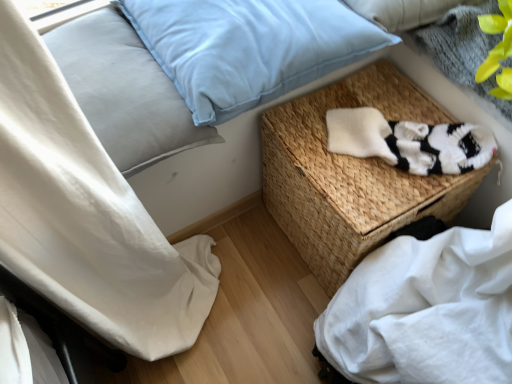
The image size is (512, 384). Describe the element at coordinates (351, 174) in the screenshot. I see `woven wicker basket at center` at that location.

What is the approximate width of white knitted socks at center-right?

It is 19.23 centimeters.

At what (x,y) coordinates should I click in order to perform the action: click on white knitted socks at center-right. Please return your answer as a coordinate pair (x, y). The image size is (512, 384). Looking at the image, I should click on (409, 142).

Describe the element at coordinates (124, 91) in the screenshot. I see `light blue fabric pillow at upper left, which is the 2th pillow from right to left` at that location.

Where is `woven wicker basket at center`? The width and height of the screenshot is (512, 384). woven wicker basket at center is located at coordinates (351, 174).

From the image's perspective, between white cotton sheet at lower right and white knitted socks at center-right, who is located below?

white cotton sheet at lower right is shown below in the image.

Is white cotton sheet at lower right oriented towards white knitted socks at center-right?

No, white cotton sheet at lower right is not oriented towards white knitted socks at center-right.

Looking at this image, from a real-world perspective, is white cotton sheet at lower right beneath white knitted socks at center-right?

Correct, in the physical world, white cotton sheet at lower right is lower than white knitted socks at center-right.

Would you say white knitted socks at center-right is to the left or to the right of light blue fabric pillow at upper left, which is the 2th pillow from right to left, in the picture?

Clearly, white knitted socks at center-right is on the right of light blue fabric pillow at upper left, which is the 2th pillow from right to left, in the image.

Is white knitted socks at center-right positioned with its back to light blue fabric pillow at upper left, which is the 2th pillow from right to left?

That's not correct — white knitted socks at center-right is not looking away from light blue fabric pillow at upper left, which is the 2th pillow from right to left.

Is the position of white knitted socks at center-right less distant than that of light blue fabric pillow at upper left, which is the first pillow in left-to-right order?

No, white knitted socks at center-right is further to the viewer.

Looking at their sizes, would you say white knitted socks at center-right is wider or thinner than light blue fabric pillow at upper left, which is the 2th pillow from right to left?

Considering their sizes, white knitted socks at center-right looks slimmer than light blue fabric pillow at upper left, which is the 2th pillow from right to left.

Is white knitted socks at center-right facing towards light blue velvety pillow at upper center, the second pillow from the left?

No, white knitted socks at center-right is not oriented towards light blue velvety pillow at upper center, the second pillow from the left.

In the scene shown: From a real-world perspective, is white knitted socks at center-right positioned over light blue velvety pillow at upper center, the second pillow from the left, based on gravity?

No, from a real-world perspective, white knitted socks at center-right is not above light blue velvety pillow at upper center, the second pillow from the left.

Between point (410, 131) and point (266, 80), which one is positioned behind?

The point (410, 131) is farther from the camera.

Is white knitted socks at center-right taller than light blue velvety pillow at upper center, the first pillow in the right-to-left sequence?

No, white knitted socks at center-right is not taller than light blue velvety pillow at upper center, the first pillow in the right-to-left sequence.

Considering the relative positions of white cotton sheet at lower right and light blue velvety pillow at upper center, the second pillow from the left, in the image provided, is white cotton sheet at lower right to the left or to the right of light blue velvety pillow at upper center, the second pillow from the left,?

white cotton sheet at lower right is to the right of light blue velvety pillow at upper center, the second pillow from the left.

Between white cotton sheet at lower right and light blue velvety pillow at upper center, the second pillow from the left, which one has less height?

Standing shorter between the two is light blue velvety pillow at upper center, the second pillow from the left.

Is the position of white cotton sheet at lower right less distant than that of light blue velvety pillow at upper center, the first pillow in the right-to-left sequence?

Yes, it is.

Image resolution: width=512 pixels, height=384 pixels. There is a white cotton sheet at lower right. Find the location of `the 2nd pillow above it (from the image's perspective)`. the 2nd pillow above it (from the image's perspective) is located at coordinates (249, 47).

Is point (185, 70) closer to viewer compared to point (374, 267)?

Yes, it is.

Would you say light blue velvety pillow at upper center, the first pillow in the right-to-left sequence, is outside white cotton sheet at lower right?

That's correct, light blue velvety pillow at upper center, the first pillow in the right-to-left sequence, is outside of white cotton sheet at lower right.

Considering the sizes of light blue velvety pillow at upper center, the first pillow in the right-to-left sequence, and white cotton sheet at lower right in the image, is light blue velvety pillow at upper center, the first pillow in the right-to-left sequence, bigger or smaller than white cotton sheet at lower right?

In the image, light blue velvety pillow at upper center, the first pillow in the right-to-left sequence, appears to be smaller than white cotton sheet at lower right.

Where is `sheet lying on the right of light blue velvety pillow at upper center, the second pillow from the left`? This screenshot has height=384, width=512. sheet lying on the right of light blue velvety pillow at upper center, the second pillow from the left is located at coordinates (426, 310).

Is woven wicker basket at center bigger than white knitted socks at center-right?

Indeed, woven wicker basket at center has a larger size compared to white knitted socks at center-right.

Does woven wicker basket at center lie behind white knitted socks at center-right?

No, woven wicker basket at center is closer to the camera.

Is woven wicker basket at center positioned with its back to white knitted socks at center-right?

No.

How distant is woven wicker basket at center from white knitted socks at center-right?

The distance of woven wicker basket at center from white knitted socks at center-right is 3.91 inches.

Find the location of `table below the light blue velvety pillow at upper center, the second pillow from the left (from the image's perspective)`. table below the light blue velvety pillow at upper center, the second pillow from the left (from the image's perspective) is located at coordinates (351, 174).

Is woven wicker basket at center far away from light blue velvety pillow at upper center, the first pillow in the right-to-left sequence?

woven wicker basket at center is actually quite close to light blue velvety pillow at upper center, the first pillow in the right-to-left sequence.

Considering the positions of point (379, 197) and point (191, 89), is point (379, 197) closer or farther from the camera than point (191, 89)?

Clearly, point (379, 197) is more distant from the camera than point (191, 89).

Find the location of `material located above the white cotton sheet at lower right (from a real-world perspective)`. material located above the white cotton sheet at lower right (from a real-world perspective) is located at coordinates (409, 142).

What are the coordinates of `pillow that is the 2nd object to the left of the white knitted socks at center-right, starting at the anchor` in the screenshot? It's located at coord(124,91).

Estimate the real-world distances between objects in this image. Which object is closer to light blue velvety pillow at upper center, the second pillow from the left, white cotton sheet at lower right or woven wicker basket at center?

woven wicker basket at center is closer to light blue velvety pillow at upper center, the second pillow from the left.

When comparing their distances from woven wicker basket at center, does white cotton sheet at lower right or light blue fabric pillow at upper left, which is the first pillow in left-to-right order, seem further?

light blue fabric pillow at upper left, which is the first pillow in left-to-right order, lies further to woven wicker basket at center than the other object.

Based on the photo, looking at the image, which one is located further to white cotton sheet at lower right, light blue velvety pillow at upper center, the first pillow in the right-to-left sequence, or woven wicker basket at center?

Based on the image, light blue velvety pillow at upper center, the first pillow in the right-to-left sequence, appears to be further to white cotton sheet at lower right.

Which object lies nearer to the anchor point white knitted socks at center-right, light blue fabric pillow at upper left, which is the 2th pillow from right to left, or woven wicker basket at center?

woven wicker basket at center lies closer to white knitted socks at center-right than the other object.

Looking at this image, considering their positions, is woven wicker basket at center positioned further to white knitted socks at center-right than white cotton sheet at lower right?

white cotton sheet at lower right is further to white knitted socks at center-right.

Based on their spatial positions, is white knitted socks at center-right or light blue velvety pillow at upper center, the second pillow from the left, further from light blue fabric pillow at upper left, which is the 2th pillow from right to left?

white knitted socks at center-right is further to light blue fabric pillow at upper left, which is the 2th pillow from right to left.

Which object lies further to the anchor point woven wicker basket at center, white cotton sheet at lower right or light blue velvety pillow at upper center, the second pillow from the left?

The object further to woven wicker basket at center is light blue velvety pillow at upper center, the second pillow from the left.

Consider the image. Considering their positions, is light blue velvety pillow at upper center, the second pillow from the left, positioned closer to white knitted socks at center-right than woven wicker basket at center?

The object closer to white knitted socks at center-right is woven wicker basket at center.

Find the location of a particular element. pillow between light blue fabric pillow at upper left, which is the 2th pillow from right to left, and woven wicker basket at center is located at coordinates (249, 47).

Image resolution: width=512 pixels, height=384 pixels. In order to click on table situated between light blue fabric pillow at upper left, which is the first pillow in left-to-right order, and white cotton sheet at lower right from left to right in this screenshot , I will do `click(351, 174)`.

Identify the location of table between light blue velvety pillow at upper center, the first pillow in the right-to-left sequence, and white cotton sheet at lower right from top to bottom. The height and width of the screenshot is (384, 512). (351, 174).

The width and height of the screenshot is (512, 384). Identify the location of pillow situated between light blue fabric pillow at upper left, which is the 2th pillow from right to left, and white knitted socks at center-right from left to right. (249, 47).